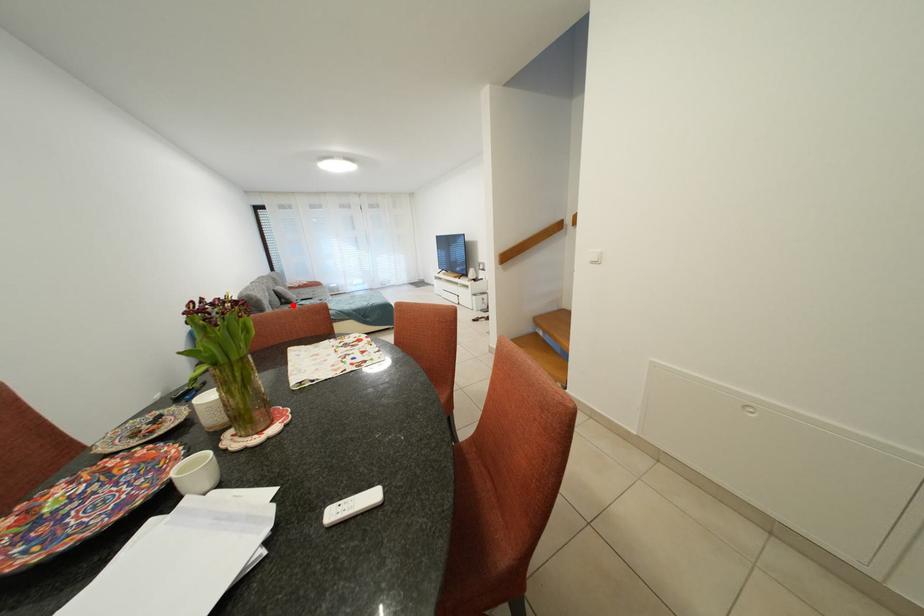
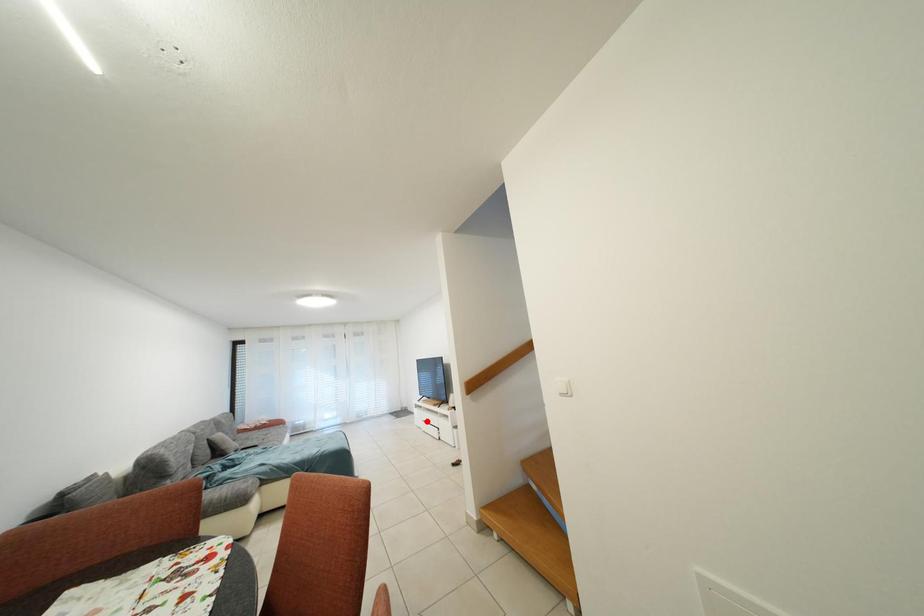
I am providing you with two images of the same scene from different viewpoints. A red point is marked on the first image and another point is marked on the second image. Is the red point in image1 aligned with the point shown in image2?

No